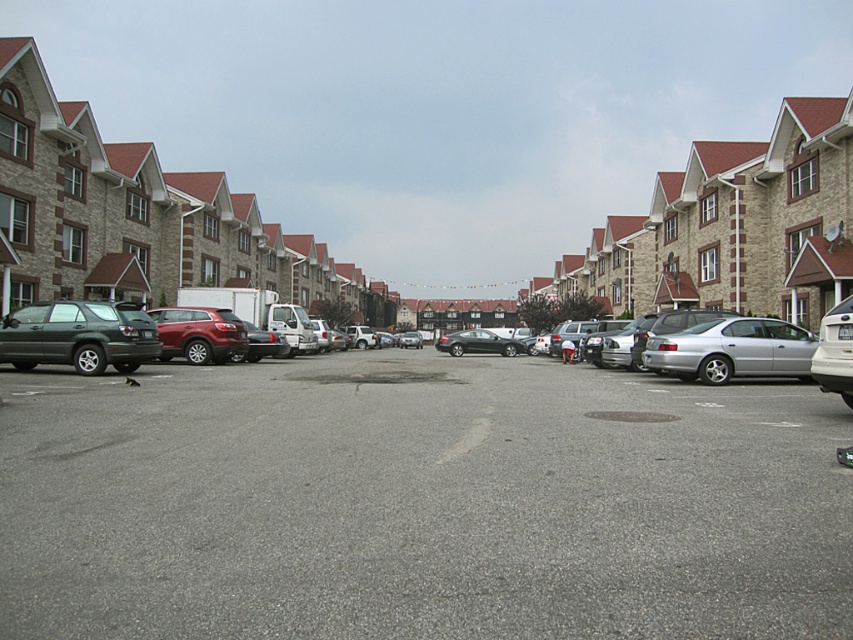
Question: Can you confirm if silver metallic sedan at right is wider than shiny silver sedan at center?

Choices:
 (A) no
 (B) yes

Answer: (A)

Question: Based on their relative distances, which object is nearer to the silver metallic sedan at right?

Choices:
 (A) silver metallic sedan at center
 (B) silver metallic sedan at center-right

Answer: (B)

Question: Does gray asphalt parking lot at center have a larger size compared to silver metallic sedan at center?

Choices:
 (A) no
 (B) yes

Answer: (B)

Question: Is matte green suv at left positioned in front of silver metallic sedan at center-right?

Choices:
 (A) no
 (B) yes

Answer: (A)

Question: Based on their relative distances, which object is nearer to the satin silver sedan at center?

Choices:
 (A) matte green suv at left
 (B) gray asphalt parking lot at center
 (C) shiny silver sedan at center
 (D) silver metallic sedan at right

Answer: (A)

Question: Among these objects, which one is farthest from the camera?

Choices:
 (A) silver metallic sedan at center-right
 (B) shiny silver sedan at center
 (C) satin red suv at center

Answer: (B)